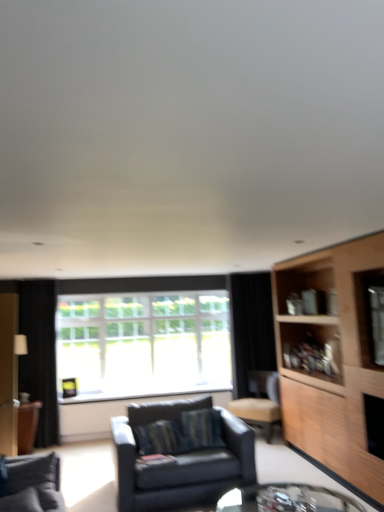
Image resolution: width=384 pixels, height=512 pixels. What do you see at coordinates (260, 402) in the screenshot? I see `leather-like beige chair at center-right` at bounding box center [260, 402].

Consider the image. In order to face clear glass table at lower center, should I rotate leftwards or rightwards?

A 10.233 degree turn to the right will do.

What are the coordinates of `clear glass window at center` in the screenshot? It's located at (144, 335).

Describe the element at coordinates (33, 484) in the screenshot. Image resolution: width=384 pixels, height=512 pixels. I see `dark gray fabric couch at lower left, which appears as the second studio couch when viewed from the right` at that location.

This screenshot has width=384, height=512. In order to click on matte black couch at center, the first studio couch in the right-to-left sequence in this screenshot , I will do (181, 461).

What do you see at coordinates (251, 327) in the screenshot? This screenshot has height=512, width=384. I see `black fabric curtain at right, which is the second curtain in left-to-right order` at bounding box center [251, 327].

This screenshot has height=512, width=384. I want to click on black fabric curtain at right, placed as the first curtain when sorted from back to front, so click(251, 327).

How much space does black fabric curtain at left, which appears as the first curtain when viewed from the front, occupy horizontally?

black fabric curtain at left, which appears as the first curtain when viewed from the front, is 10.62 inches wide.

Locate an element on the screen. black fabric curtain at left, which is the second curtain in back-to-front order is located at coordinates (39, 354).

The image size is (384, 512). Find the location of `light wood cabinet at right`. light wood cabinet at right is located at coordinates (337, 361).

Considering the sizes of objects black fabric curtain at left, which appears as the first curtain when viewed from the front, and matte black couch at center, the first studio couch in the right-to-left sequence, in the image provided, who is thinner, black fabric curtain at left, which appears as the first curtain when viewed from the front, or matte black couch at center, the first studio couch in the right-to-left sequence,?

black fabric curtain at left, which appears as the first curtain when viewed from the front.

From the picture: Does black fabric curtain at left, the second curtain in the right-to-left sequence, have a lesser height compared to matte black couch at center, marked as the second studio couch in a left-to-right arrangement?

Incorrect, the height of black fabric curtain at left, the second curtain in the right-to-left sequence, does not fall short of that of matte black couch at center, marked as the second studio couch in a left-to-right arrangement.

Which is nearer, (x=49, y=320) or (x=145, y=501)?

Positioned in front is point (x=145, y=501).

From a real-world perspective, who is located higher, black fabric curtain at left, which is the second curtain in back-to-front order, or matte black couch at center, marked as the second studio couch in a left-to-right arrangement?

black fabric curtain at left, which is the second curtain in back-to-front order.

Consider the image. Considering the sizes of objects black fabric curtain at right, which is the second curtain in left-to-right order, and matte black couch at center, the first studio couch in the right-to-left sequence, in the image provided, who is taller, black fabric curtain at right, which is the second curtain in left-to-right order, or matte black couch at center, the first studio couch in the right-to-left sequence,?

black fabric curtain at right, which is the second curtain in left-to-right order, is taller.

Looking at this image, how many degrees apart are the facing directions of black fabric curtain at right, placed as the first curtain when sorted from back to front, and matte black couch at center, the first studio couch when ordered from back to front?

black fabric curtain at right, placed as the first curtain when sorted from back to front, and matte black couch at center, the first studio couch when ordered from back to front, are facing 1.52 degrees away from each other.

Does point (267, 348) appear closer or farther from the camera than point (163, 472)?

Clearly, point (267, 348) is more distant from the camera than point (163, 472).

Measure the distance from black fabric curtain at right, which is the second curtain in left-to-right order, to matte black couch at center, which appears as the 2th studio couch when viewed from the front.

They are 6.38 feet apart.

Is point (46, 458) closer to camera compared to point (267, 423)?

Yes, point (46, 458) is in front of point (267, 423).

Relative to leather-like beige chair at center-right, is dark gray fabric couch at lower left, the second studio couch viewed from the back, in front or behind?

dark gray fabric couch at lower left, the second studio couch viewed from the back, is positioned closer to the viewer than leather-like beige chair at center-right.

Between dark gray fabric couch at lower left, which appears as the first studio couch when viewed from the left, and leather-like beige chair at center-right, which one has more height?

Standing taller between the two is leather-like beige chair at center-right.

Is dark gray fabric couch at lower left, the second studio couch viewed from the back, positioned beyond the bounds of leather-like beige chair at center-right?

Indeed, dark gray fabric couch at lower left, the second studio couch viewed from the back, is completely outside leather-like beige chair at center-right.

Identify the location of chair lying behind the light wood cabinet at right. This screenshot has height=512, width=384. (260, 402).

Between point (236, 401) and point (353, 458), which one is positioned in front?

Point (353, 458)

Does leather-like beige chair at center-right have a lesser width compared to light wood cabinet at right?

In fact, leather-like beige chair at center-right might be wider than light wood cabinet at right.

From the image's perspective, which object appears higher, leather-like beige chair at center-right or light wood cabinet at right?

From the image's view, light wood cabinet at right is above.

Is dark gray fabric couch at lower left, which appears as the second studio couch when viewed from the right, a part of black fabric curtain at left, positioned as the first curtain in left-to-right order?

No.

Is black fabric curtain at left, the second curtain in the right-to-left sequence, looking in the opposite direction of dark gray fabric couch at lower left, which appears as the second studio couch when viewed from the right?

No, black fabric curtain at left, the second curtain in the right-to-left sequence, is not facing the opposite direction of dark gray fabric couch at lower left, which appears as the second studio couch when viewed from the right.

Between black fabric curtain at left, the second curtain in the right-to-left sequence, and dark gray fabric couch at lower left, the first studio couch from the front, which one has less height?

With less height is dark gray fabric couch at lower left, the first studio couch from the front.

Looking at the image, does black fabric curtain at left, which is the second curtain in back-to-front order, seem bigger or smaller compared to dark gray fabric couch at lower left, which appears as the second studio couch when viewed from the right?

black fabric curtain at left, which is the second curtain in back-to-front order, is bigger than dark gray fabric couch at lower left, which appears as the second studio couch when viewed from the right.

Is matte black couch at center, marked as the second studio couch in a left-to-right arrangement, not near clear glass window at center?

Yes, matte black couch at center, marked as the second studio couch in a left-to-right arrangement, is far from clear glass window at center.

From the picture: Which of these two, matte black couch at center, the first studio couch in the right-to-left sequence, or clear glass window at center, stands shorter?

Standing shorter between the two is matte black couch at center, the first studio couch in the right-to-left sequence.

Is matte black couch at center, the first studio couch in the right-to-left sequence, to the left of clear glass window at center from the viewer's perspective?

No.

Which object is closer to the camera, black fabric curtain at left, the second curtain in the right-to-left sequence, or light wood cabinet at right?

light wood cabinet at right.

From the image's perspective, is black fabric curtain at left, the second curtain in the right-to-left sequence, beneath light wood cabinet at right?

Yes.

Looking at this image, considering the sizes of objects black fabric curtain at left, which appears as the first curtain when viewed from the front, and light wood cabinet at right in the image provided, who is bigger, black fabric curtain at left, which appears as the first curtain when viewed from the front, or light wood cabinet at right?

With larger size is light wood cabinet at right.

The height and width of the screenshot is (512, 384). What are the coordinates of `the 2nd studio couch positioned below the black fabric curtain at left, which is the second curtain in back-to-front order (from a real-world perspective)` in the screenshot? It's located at (181, 461).

Image resolution: width=384 pixels, height=512 pixels. What are the coordinates of `the 1st studio couch in front of the black fabric curtain at right, placed as the first curtain when sorted from back to front, counting from the anchor's position` in the screenshot? It's located at coord(181,461).

Estimate the real-world distances between objects in this image. Which object is closer to black fabric curtain at left, positioned as the first curtain in left-to-right order, leather-like beige chair at center-right or clear glass window at center?

clear glass window at center lies closer to black fabric curtain at left, positioned as the first curtain in left-to-right order, than the other object.

Considering their positions, is matte black couch at center, which appears as the 2th studio couch when viewed from the front, positioned further to black fabric curtain at left, positioned as the first curtain in left-to-right order, than clear glass table at lower center?

clear glass table at lower center is further to black fabric curtain at left, positioned as the first curtain in left-to-right order.

When comparing their distances from dark gray fabric couch at lower left, which appears as the second studio couch when viewed from the right, does light wood cabinet at right or leather-like beige chair at center-right seem closer?

Among the two, light wood cabinet at right is located nearer to dark gray fabric couch at lower left, which appears as the second studio couch when viewed from the right.

When comparing their distances from black fabric curtain at right, which is the second curtain in left-to-right order, does black fabric curtain at left, which appears as the first curtain when viewed from the front, or light wood cabinet at right seem further?

The object further to black fabric curtain at right, which is the second curtain in left-to-right order, is black fabric curtain at left, which appears as the first curtain when viewed from the front.

Estimate the real-world distances between objects in this image. Which object is closer to leather-like beige chair at center-right, light wood cabinet at right or clear glass window at center?

The object closer to leather-like beige chair at center-right is clear glass window at center.

When comparing their distances from light wood cabinet at right, does black fabric curtain at left, which is the second curtain in back-to-front order, or black fabric curtain at right, the second curtain when ordered from front to back, seem further?

Based on the image, black fabric curtain at left, which is the second curtain in back-to-front order, appears to be further to light wood cabinet at right.

Based on the photo, considering their positions, is dark gray fabric couch at lower left, the second studio couch viewed from the back, positioned further to clear glass table at lower center than leather-like beige chair at center-right?

leather-like beige chair at center-right.

Considering their positions, is clear glass table at lower center positioned closer to matte black couch at center, the first studio couch when ordered from back to front, than black fabric curtain at left, which is the second curtain in back-to-front order?

clear glass table at lower center is positioned closer to the anchor matte black couch at center, the first studio couch when ordered from back to front.

Find the location of a particular element. chair between dark gray fabric couch at lower left, which appears as the second studio couch when viewed from the right, and clear glass window at center from front to back is located at coordinates (260, 402).

Identify the location of curtain between black fabric curtain at left, the second curtain in the right-to-left sequence, and light wood cabinet at right. The height and width of the screenshot is (512, 384). (251, 327).

The width and height of the screenshot is (384, 512). Find the location of `cabinetry between dark gray fabric couch at lower left, which appears as the second studio couch when viewed from the right, and clear glass window at center in the front-back direction`. cabinetry between dark gray fabric couch at lower left, which appears as the second studio couch when viewed from the right, and clear glass window at center in the front-back direction is located at coordinates (337, 361).

This screenshot has width=384, height=512. I want to click on studio couch located between light wood cabinet at right and clear glass window at center in the depth direction, so click(181, 461).